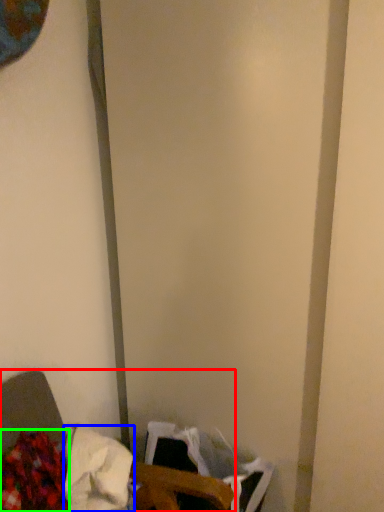
Question: Which is farther away from furniture (highlighted by a red box)? waste (highlighted by a blue box) or waste (highlighted by a green box)?

Choices:
 (A) waste
 (B) waste

Answer: (B)